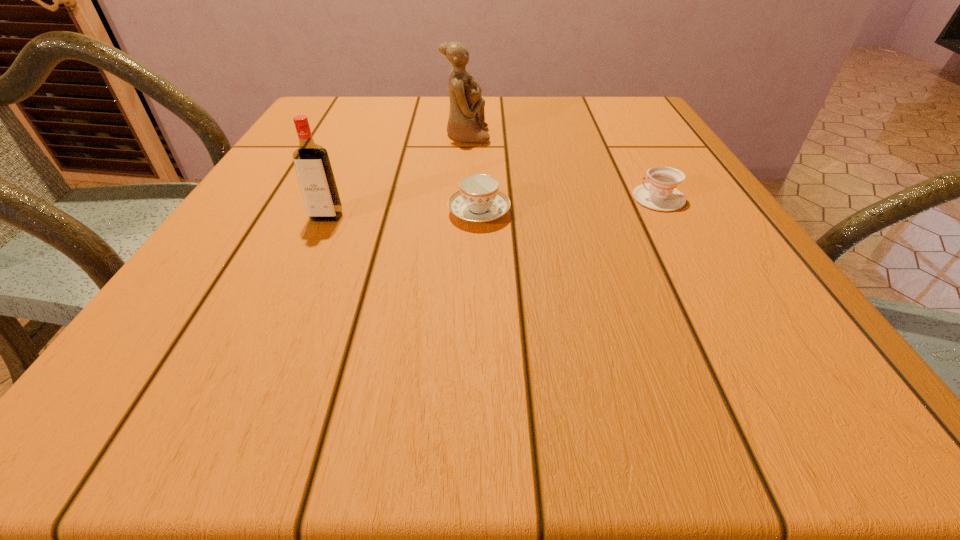
Identify the location of free space at the right edge of the desktop. (627, 160).

Identify the location of free space at the far right corner of the desktop. This screenshot has height=540, width=960. (658, 130).

In the image, there is a desktop. At what (x,y) coordinates should I click in order to perform the action: click on free space at the near right corner. Please return your answer as a coordinate pair (x, y). The image size is (960, 540). Looking at the image, I should click on (852, 409).

This screenshot has height=540, width=960. Identify the location of empty space that is in between the shorter teacup and the farthest object. (563, 167).

Locate an element on the screen. This screenshot has height=540, width=960. free space between the right teacup and the figurine is located at coordinates (563, 167).

Identify the location of free space between the left teacup and the vodka. The width and height of the screenshot is (960, 540). (403, 214).

Find the location of a particular element. This screenshot has height=540, width=960. free space between the shorter teacup and the taller teacup is located at coordinates (569, 205).

This screenshot has width=960, height=540. Identify the location of unoccupied area between the taller teacup and the farthest object. (472, 174).

I want to click on free space between the taller teacup and the figurine, so click(x=472, y=174).

Where is `free space between the farthest object and the shortest object`? This screenshot has width=960, height=540. free space between the farthest object and the shortest object is located at coordinates (563, 167).